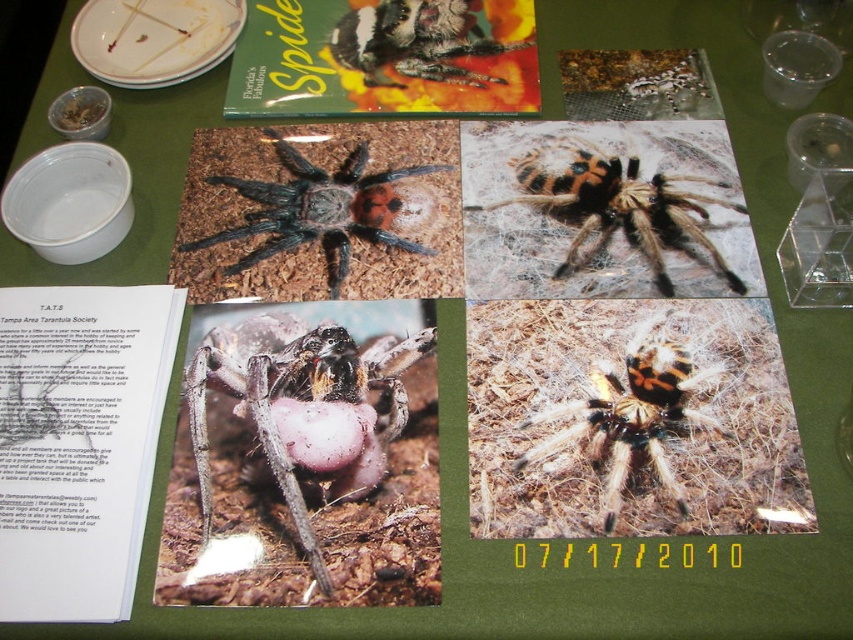
Who is positioned more to the right, fluffy orange and black spider at center or fluffy fur spider at upper center?

fluffy orange and black spider at center is more to the right.

Which of these two, fluffy orange and black spider at center or fluffy fur spider at upper center, stands shorter?

fluffy fur spider at upper center

This screenshot has width=853, height=640. I want to click on fluffy orange and black spider at center, so click(x=631, y=417).

Based on the photo, can you confirm if matte paper book at upper center is thinner than matte gray spider at center?

No.

Can you confirm if matte paper book at upper center is positioned to the right of matte gray spider at center?

Indeed, matte paper book at upper center is positioned on the right side of matte gray spider at center.

Does point (335, 60) come behind point (308, 461)?

Yes, point (335, 60) is farther from viewer.

Image resolution: width=853 pixels, height=640 pixels. Identify the location of matte paper book at upper center. (384, 58).

Is black and orange hairy tarantula at upper right thinner than fluffy orange and black spider at center?

No.

In the scene shown: Can you confirm if black and orange hairy tarantula at upper right is shorter than fluffy orange and black spider at center?

Incorrect, black and orange hairy tarantula at upper right's height does not fall short of fluffy orange and black spider at center's.

Describe the element at coordinates (605, 212) in the screenshot. I see `black and orange hairy tarantula at upper right` at that location.

The width and height of the screenshot is (853, 640). I want to click on black and orange hairy tarantula at upper right, so click(605, 212).